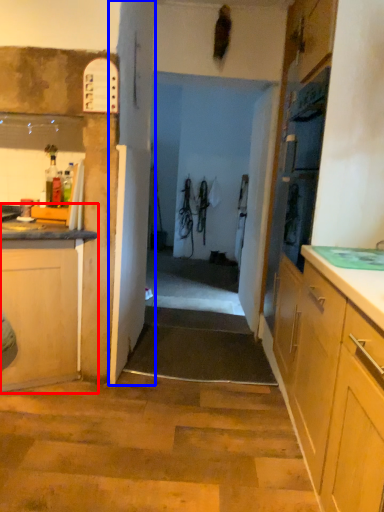
Question: Which object is closer to the camera taking this photo, cabinetry (highlighted by a red box) or door (highlighted by a blue box)?

Choices:
 (A) cabinetry
 (B) door

Answer: (A)